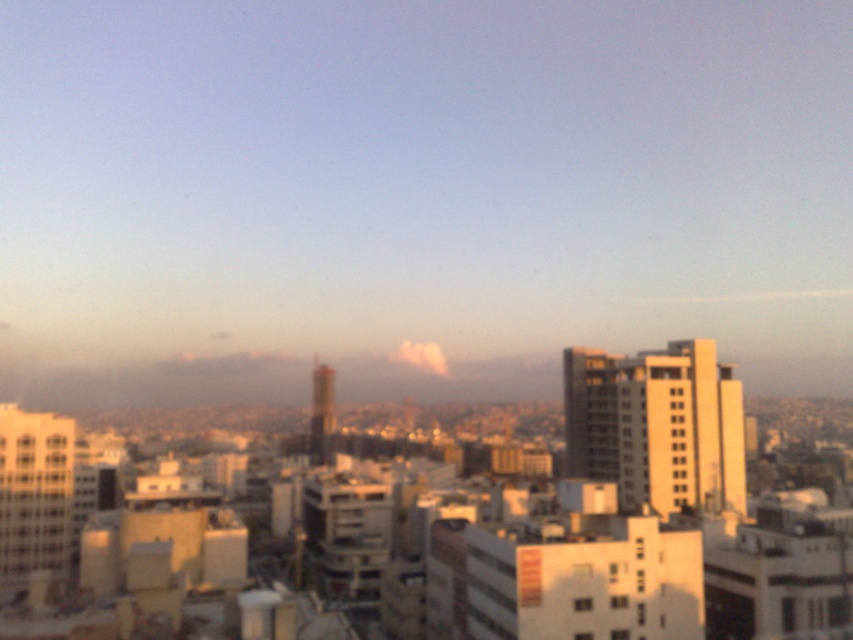
Question: Which of the following is the farthest from the observer?

Choices:
 (A) white matte building at center
 (B) yellow concrete building at right

Answer: (B)

Question: Observing the image, what is the correct spatial positioning of white matte building at center in reference to yellow concrete building at right?

Choices:
 (A) above
 (B) below

Answer: (B)

Question: Can you confirm if white matte building at center is wider than yellow concrete building at right?

Choices:
 (A) yes
 (B) no

Answer: (A)

Question: Is white matte building at center bigger than yellow concrete building at right?

Choices:
 (A) yes
 (B) no

Answer: (A)

Question: Among these points, which one is farthest from the camera?

Choices:
 (A) (700, 573)
 (B) (717, 368)

Answer: (B)